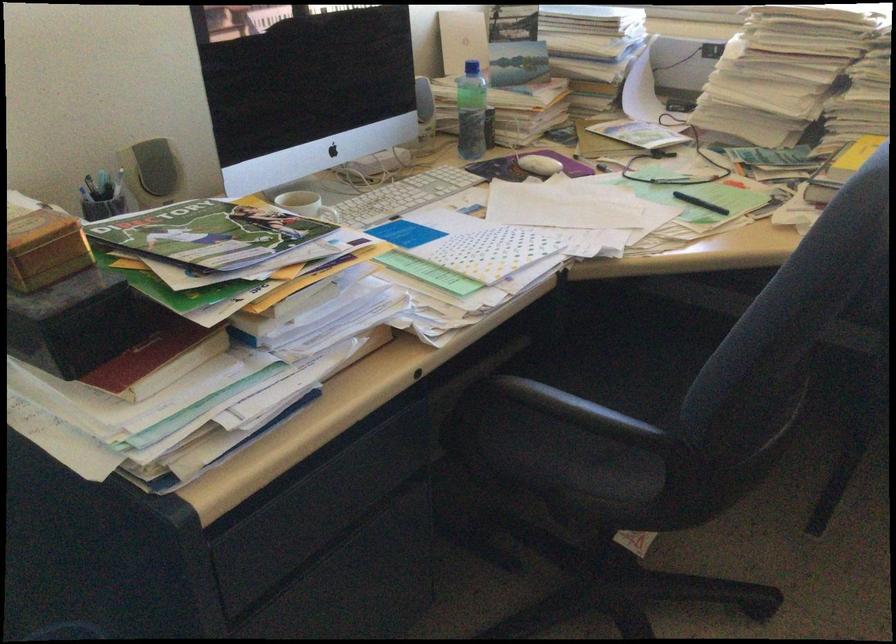
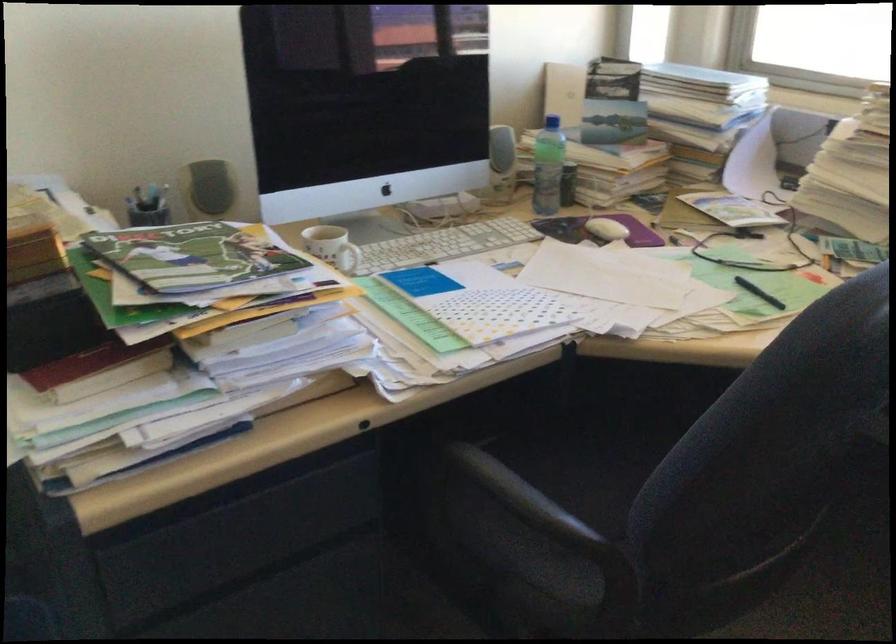
Where in the second image is the point corresponding to [597,412] from the first image?

(532, 506)